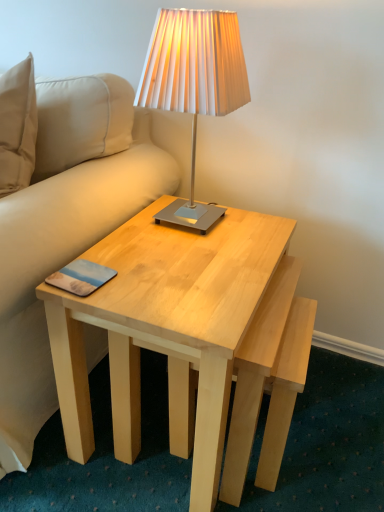
The height and width of the screenshot is (512, 384). Identify the location of vacant space to the right of matte plastic pad at lower left. (178, 311).